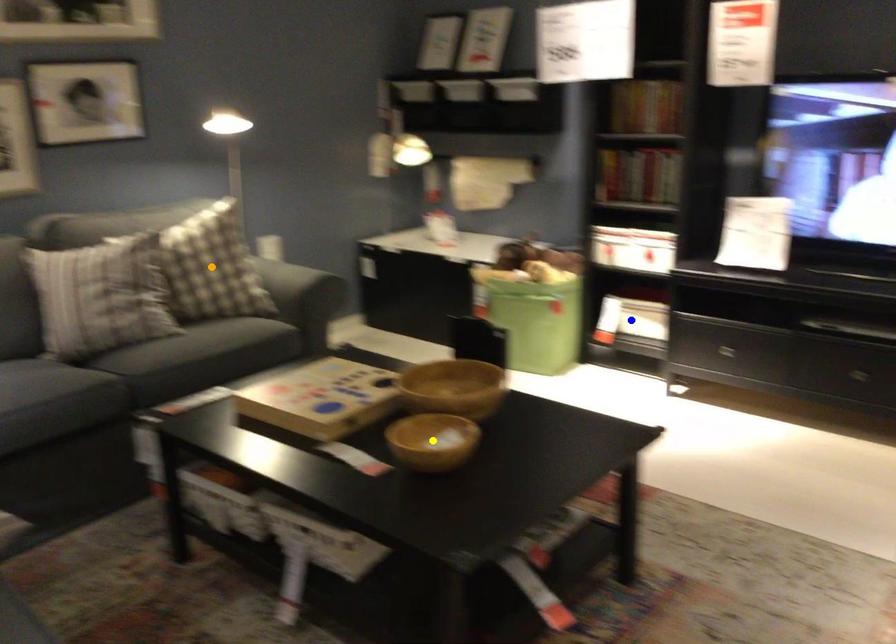
Order these from nearest to farthest:
A) yellow point
B) blue point
C) orange point

blue point
orange point
yellow point